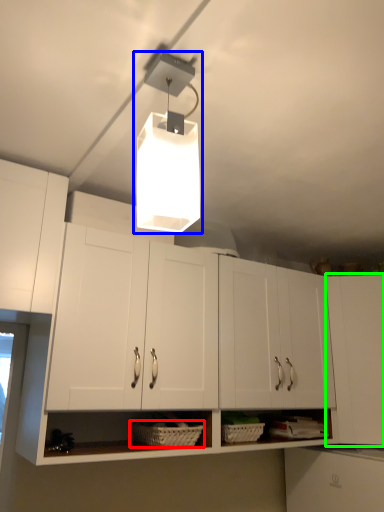
Question: Based on their relative distances, which object is farther from basket (highlighted by a red box)? Choose from lamp (highlighted by a blue box) and cabinetry (highlighted by a green box).

Choices:
 (A) lamp
 (B) cabinetry

Answer: (A)